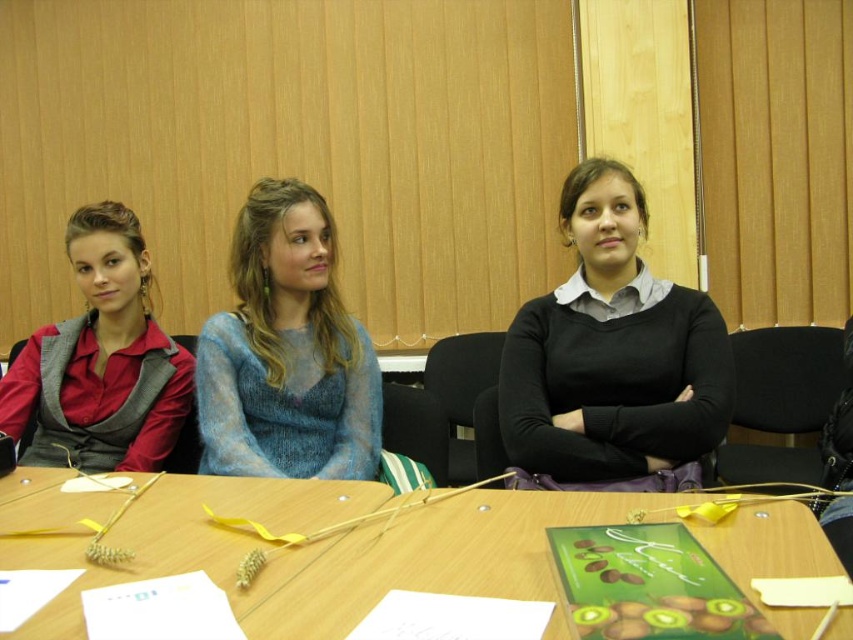
Question: Is wooden table at center wider than black matte sweater at center?

Choices:
 (A) yes
 (B) no

Answer: (A)

Question: Which point appears closest to the camera in this image?

Choices:
 (A) (225, 333)
 (B) (517, 320)
 (C) (770, 618)
 (D) (64, 385)

Answer: (C)

Question: Which of the following is the closest to the observer?

Choices:
 (A) blue fuzzy sweater at center
 (B) wooden table at center
 (C) black matte sweater at center

Answer: (B)

Question: Which point is closer to the camera taking this photo?

Choices:
 (A) (134, 518)
 (B) (152, 440)

Answer: (A)

Question: From the image, what is the correct spatial relationship of wooden table at center in relation to black matte sweater at center?

Choices:
 (A) below
 (B) above

Answer: (A)

Question: Does black matte sweater at center appear under blue fuzzy sweater at center?

Choices:
 (A) no
 (B) yes

Answer: (A)